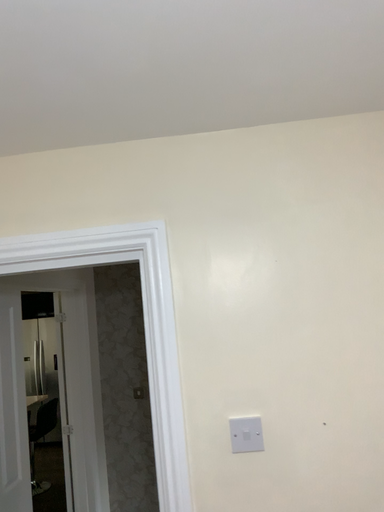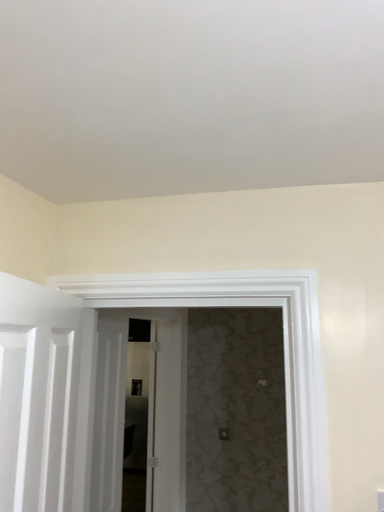
Question: Which way did the camera rotate in the video?

Choices:
 (A) rotated right
 (B) rotated left

Answer: (B)